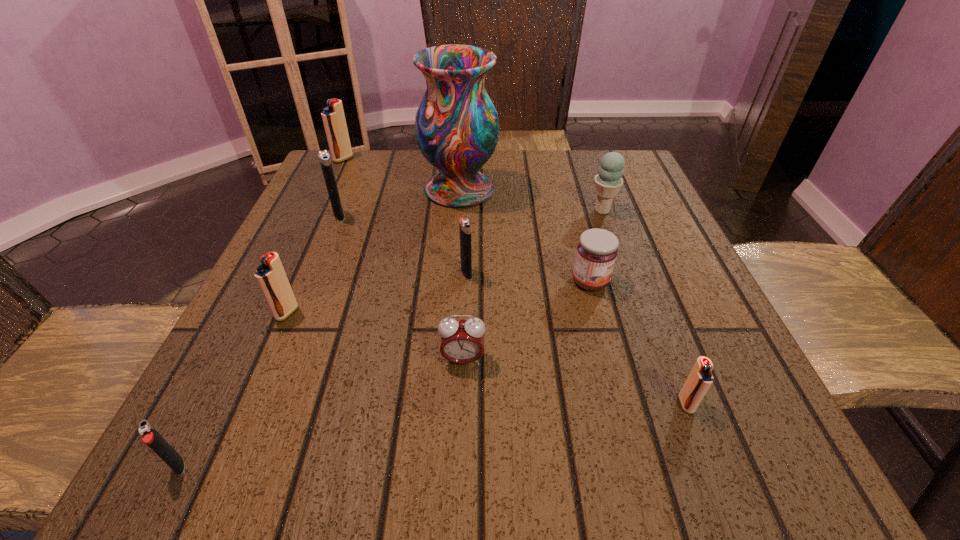
Identify the location of vacant space situated 0.320m on the front of the farthest black igniter. (288, 342).

Where is `free space located on the front of the ice cream`? free space located on the front of the ice cream is located at coordinates click(x=623, y=269).

Image resolution: width=960 pixels, height=540 pixels. What are the coordinates of `free spot located on the front of the fifth igniter from left to right` in the screenshot? It's located at 464,352.

You are a GUI agent. You are given a task and a screenshot of the screen. Output one action in this format:
    pyautogui.click(x=<x>, y=<y>)
    Task: Click on the free point located 0.130m on the right of the second smallest red igniter
    Image resolution: width=960 pixels, height=540 pixels.
    Given the screenshot: What is the action you would take?
    pyautogui.click(x=374, y=313)

Where is `vacant space situated on the back of the eighth object from left to right`? The height and width of the screenshot is (540, 960). vacant space situated on the back of the eighth object from left to right is located at coordinates (582, 252).

The height and width of the screenshot is (540, 960). Find the location of `free spot located 0.170m on the clock face of the third nearest object`. free spot located 0.170m on the clock face of the third nearest object is located at coordinates (458, 485).

Image resolution: width=960 pixels, height=540 pixels. What are the coordinates of `vacant region located on the back of the rightmost igniter` in the screenshot? It's located at (633, 263).

This screenshot has height=540, width=960. I want to click on vacant space located on the right of the smallest black igniter, so click(x=307, y=465).

Find the location of a particular element. vase present at the far edge is located at coordinates (456, 125).

Find the location of a particular element. This screenshot has height=540, width=960. igniter that is at the far edge is located at coordinates (x=333, y=117).